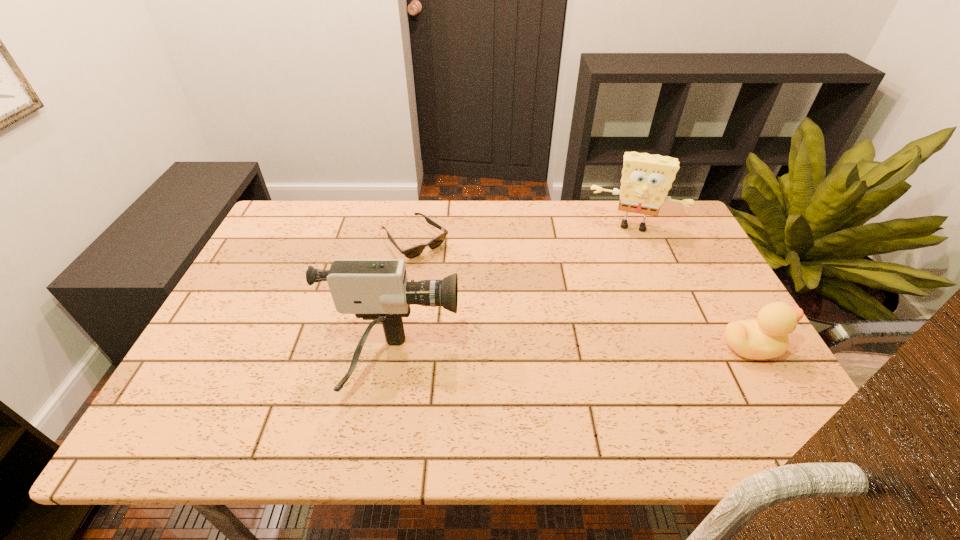
Locate an element on the screen. free space between the sunglasses and the sponge is located at coordinates (524, 233).

This screenshot has width=960, height=540. I want to click on the second closest object to the duck, so click(x=378, y=290).

You are a GUI agent. You are given a task and a screenshot of the screen. Output one action in this format:
    pyautogui.click(x=<x>, y=<y>)
    Task: Click on the object that stands as the closest to the duck
    Image resolution: width=960 pixels, height=540 pixels.
    Given the screenshot: What is the action you would take?
    point(646,179)

Identify the location of blank space that satisfies the following two spatial constraints: 1. on the front side of the duck; 2. at the beak of the sponge. (685, 347).

Locate an element on the screen. free location that satisfies the following two spatial constraints: 1. on the back side of the sunglasses; 2. on the left side of the sponge is located at coordinates (418, 225).